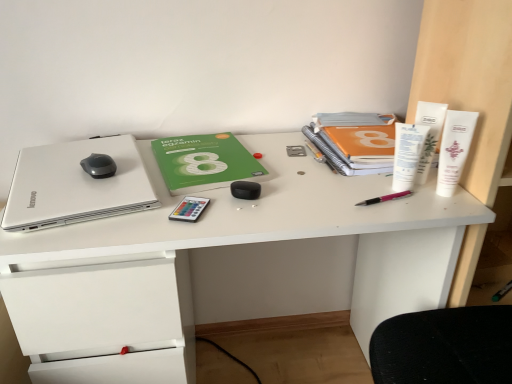
This screenshot has height=384, width=512. I want to click on vacant space that's between green matte paperback book at center, which appears as the 1th paperback book when viewed from the left, and white plastic tube at upper right, the 2th stationery positioned from the right, so click(x=293, y=168).